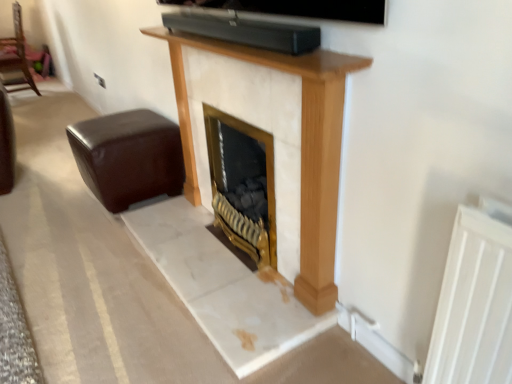
The width and height of the screenshot is (512, 384). Describe the element at coordinates (128, 157) in the screenshot. I see `brown leather ottoman at lower left, the 1th furniture when ordered from front to back` at that location.

Where is `brown leather ottoman at lower left, placed as the 2th furniture when sorted from back to front`? brown leather ottoman at lower left, placed as the 2th furniture when sorted from back to front is located at coordinates click(128, 157).

Measure the distance between point [153,167] and camera.

Point [153,167] is 2.40 meters from camera.

Measure the distance between brown leather ottoman at left, acting as the second furniture starting from the right, and camera.

They are 4.64 meters apart.

Describe the element at coordinates (16, 56) in the screenshot. I see `brown leather ottoman at left, which appears as the 2th furniture when ordered from the bottom` at that location.

The width and height of the screenshot is (512, 384). Find the location of `brown leather ottoman at left, acting as the second furniture starting from the right`. brown leather ottoman at left, acting as the second furniture starting from the right is located at coordinates (16, 56).

How much space does brown leather ottoman at left, which appears as the 2th furniture when ordered from the bottom, occupy vertically?

brown leather ottoman at left, which appears as the 2th furniture when ordered from the bottom, is 1.03 meters in height.

At what (x,y) coordinates should I click in order to perform the action: click on brown leather ottoman at lower left, placed as the 2th furniture when sorted from back to front. Please return your answer as a coordinate pair (x, y). The width and height of the screenshot is (512, 384). Looking at the image, I should click on (128, 157).

In the scene shown: Considering the positions of objects brown leather ottoman at lower left, the 1th furniture when ordered from front to back, and brown leather ottoman at left, the second furniture viewed from the front, in the image provided, who is more to the right, brown leather ottoman at lower left, the 1th furniture when ordered from front to back, or brown leather ottoman at left, the second furniture viewed from the front,?

Positioned to the right is brown leather ottoman at lower left, the 1th furniture when ordered from front to back.

Is brown leather ottoman at lower left, marked as the 1th furniture in a bottom-to-top arrangement, positioned in front of brown leather ottoman at left, the second furniture viewed from the front?

Yes, brown leather ottoman at lower left, marked as the 1th furniture in a bottom-to-top arrangement, is in front of brown leather ottoman at left, the second furniture viewed from the front.

Is point (99, 124) farther from camera compared to point (0, 62)?

No.

From the image's perspective, relative to brown leather ottoman at left, arranged as the 1th furniture when viewed from the back, is brown leather ottoman at lower left, placed as the 2th furniture when sorted from back to front, above or below?

brown leather ottoman at lower left, placed as the 2th furniture when sorted from back to front, is situated lower than brown leather ottoman at left, arranged as the 1th furniture when viewed from the back, in the image.

From a real-world perspective, is brown leather ottoman at lower left, acting as the 2th furniture starting from the top, physically below brown leather ottoman at left, which appears as the 2th furniture when ordered from the bottom?

Yes, from a real-world perspective, brown leather ottoman at lower left, acting as the 2th furniture starting from the top, is below brown leather ottoman at left, which appears as the 2th furniture when ordered from the bottom.

Which of these two, brown leather ottoman at lower left, placed as the 2th furniture when sorted from back to front, or brown leather ottoman at left, placed as the 1th furniture when sorted from top to bottom, is wider?

Wider between the two is brown leather ottoman at lower left, placed as the 2th furniture when sorted from back to front.

Considering the relative sizes of brown leather ottoman at lower left, marked as the 1th furniture in a bottom-to-top arrangement, and brown leather ottoman at left, arranged as the 1th furniture when viewed from the back, in the image provided, is brown leather ottoman at lower left, marked as the 1th furniture in a bottom-to-top arrangement, taller than brown leather ottoman at left, arranged as the 1th furniture when viewed from the back,?

Incorrect, the height of brown leather ottoman at lower left, marked as the 1th furniture in a bottom-to-top arrangement, is not larger of that of brown leather ottoman at left, arranged as the 1th furniture when viewed from the back.

In the scene shown: Looking at the image, does brown leather ottoman at lower left, acting as the 2th furniture starting from the top, seem bigger or smaller compared to brown leather ottoman at left, marked as the 1th furniture in a left-to-right arrangement?

brown leather ottoman at lower left, acting as the 2th furniture starting from the top, is smaller than brown leather ottoman at left, marked as the 1th furniture in a left-to-right arrangement.

Is brown leather ottoman at lower left, marked as the 1th furniture in a bottom-to-top arrangement, completely or partially outside of brown leather ottoman at left, which appears as the 2th furniture when ordered from the bottom?

Yes, brown leather ottoman at lower left, marked as the 1th furniture in a bottom-to-top arrangement, is located beyond the bounds of brown leather ottoman at left, which appears as the 2th furniture when ordered from the bottom.

Is brown leather ottoman at lower left, arranged as the first furniture when viewed from the right, far from brown leather ottoman at left, acting as the second furniture starting from the right?

Yes, brown leather ottoman at lower left, arranged as the first furniture when viewed from the right, is far from brown leather ottoman at left, acting as the second furniture starting from the right.

From the picture: Could you tell me if brown leather ottoman at lower left, the 1th furniture when ordered from front to back, is turned towards brown leather ottoman at left, placed as the 1th furniture when sorted from top to bottom?

No.

Measure the distance between brown leather ottoman at lower left, placed as the 2th furniture when sorted from left to right, and brown leather ottoman at left, acting as the second furniture starting from the right.

brown leather ottoman at lower left, placed as the 2th furniture when sorted from left to right, and brown leather ottoman at left, acting as the second furniture starting from the right, are 9.81 feet apart from each other.

Locate an element on the screen. furniture on the right of brown leather ottoman at left, marked as the 1th furniture in a left-to-right arrangement is located at coordinates (128, 157).

Considering the relative positions of brown leather ottoman at left, marked as the 1th furniture in a left-to-right arrangement, and brown leather ottoman at lower left, arranged as the first furniture when viewed from the right, in the image provided, is brown leather ottoman at left, marked as the 1th furniture in a left-to-right arrangement, to the left of brown leather ottoman at lower left, arranged as the first furniture when viewed from the right, from the viewer's perspective?

Indeed, brown leather ottoman at left, marked as the 1th furniture in a left-to-right arrangement, is positioned on the left side of brown leather ottoman at lower left, arranged as the first furniture when viewed from the right.

Who is more distant, brown leather ottoman at left, arranged as the 1th furniture when viewed from the back, or brown leather ottoman at lower left, placed as the 2th furniture when sorted from back to front?

brown leather ottoman at left, arranged as the 1th furniture when viewed from the back, is further away from the camera.

Does point (3, 65) come farther from viewer compared to point (104, 174)?

Yes, it is.

From the image's perspective, which one is positioned lower, brown leather ottoman at left, the second furniture viewed from the front, or brown leather ottoman at lower left, placed as the 2th furniture when sorted from back to front?

From the image's view, brown leather ottoman at lower left, placed as the 2th furniture when sorted from back to front, is below.

From a real-world perspective, who is located higher, brown leather ottoman at left, placed as the 1th furniture when sorted from top to bottom, or brown leather ottoman at lower left, placed as the 2th furniture when sorted from back to front?

brown leather ottoman at left, placed as the 1th furniture when sorted from top to bottom, from a real-world perspective.

Between brown leather ottoman at left, marked as the 1th furniture in a left-to-right arrangement, and brown leather ottoman at lower left, placed as the 2th furniture when sorted from back to front, which one has smaller width?

Thinner between the two is brown leather ottoman at left, marked as the 1th furniture in a left-to-right arrangement.

Between brown leather ottoman at left, the second furniture viewed from the front, and brown leather ottoman at lower left, marked as the 1th furniture in a bottom-to-top arrangement, which one has more height?

brown leather ottoman at left, the second furniture viewed from the front.

Based on their sizes in the image, would you say brown leather ottoman at left, acting as the second furniture starting from the right, is bigger or smaller than brown leather ottoman at lower left, the 1th furniture when ordered from front to back?

brown leather ottoman at left, acting as the second furniture starting from the right, is bigger than brown leather ottoman at lower left, the 1th furniture when ordered from front to back.

Is brown leather ottoman at lower left, marked as the 1th furniture in a bottom-to-top arrangement, completely or partially inside brown leather ottoman at left, arranged as the 1th furniture when viewed from the back?

No, brown leather ottoman at left, arranged as the 1th furniture when viewed from the back, does not contain brown leather ottoman at lower left, marked as the 1th furniture in a bottom-to-top arrangement.

Is brown leather ottoman at left, acting as the second furniture starting from the right, beside brown leather ottoman at lower left, placed as the 2th furniture when sorted from back to front?

No.

Is brown leather ottoman at left, the second furniture viewed from the front, looking in the opposite direction of brown leather ottoman at lower left, placed as the 2th furniture when sorted from back to front?

No, brown leather ottoman at lower left, placed as the 2th furniture when sorted from back to front, is not at the back of brown leather ottoman at left, the second furniture viewed from the front.

Can you tell me how much brown leather ottoman at left, acting as the second furniture starting from the right, and brown leather ottoman at lower left, placed as the 2th furniture when sorted from back to front, differ in facing direction?

There is a 1.24-degree angle between the facing directions of brown leather ottoman at left, acting as the second furniture starting from the right, and brown leather ottoman at lower left, placed as the 2th furniture when sorted from back to front.

From the picture: Could you measure the distance between brown leather ottoman at left, arranged as the 1th furniture when viewed from the back, and brown leather ottoman at lower left, placed as the 2th furniture when sorted from left to right?

brown leather ottoman at left, arranged as the 1th furniture when viewed from the back, is 9.81 feet from brown leather ottoman at lower left, placed as the 2th furniture when sorted from left to right.

Locate an element on the screen. furniture above the brown leather ottoman at lower left, placed as the 2th furniture when sorted from left to right (from the image's perspective) is located at coordinates (16, 56).

The image size is (512, 384). I want to click on furniture below the brown leather ottoman at left, arranged as the 1th furniture when viewed from the back (from a real-world perspective), so click(128, 157).

Find the location of a particular element. furniture located above the brown leather ottoman at lower left, the 1th furniture when ordered from front to back (from a real-world perspective) is located at coordinates (16, 56).